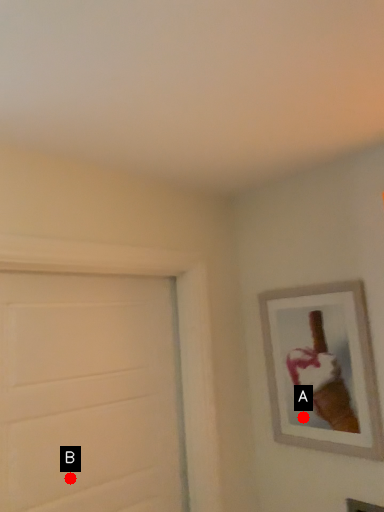
Question: Two points are circled on the image, labeled by A and B beside each circle. Among these points, which one is nearest to the camera?

Choices:
 (A) A is closer
 (B) B is closer

Answer: (B)